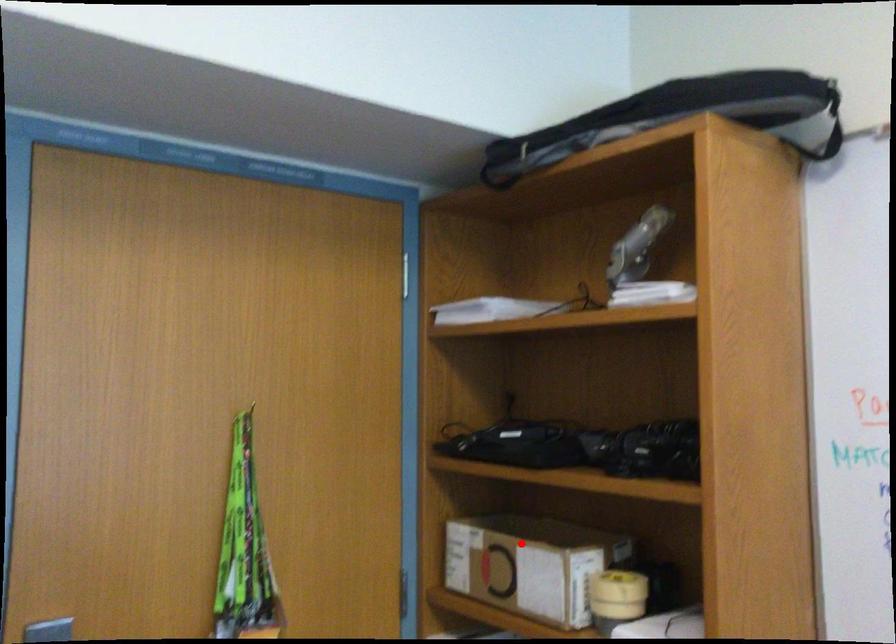
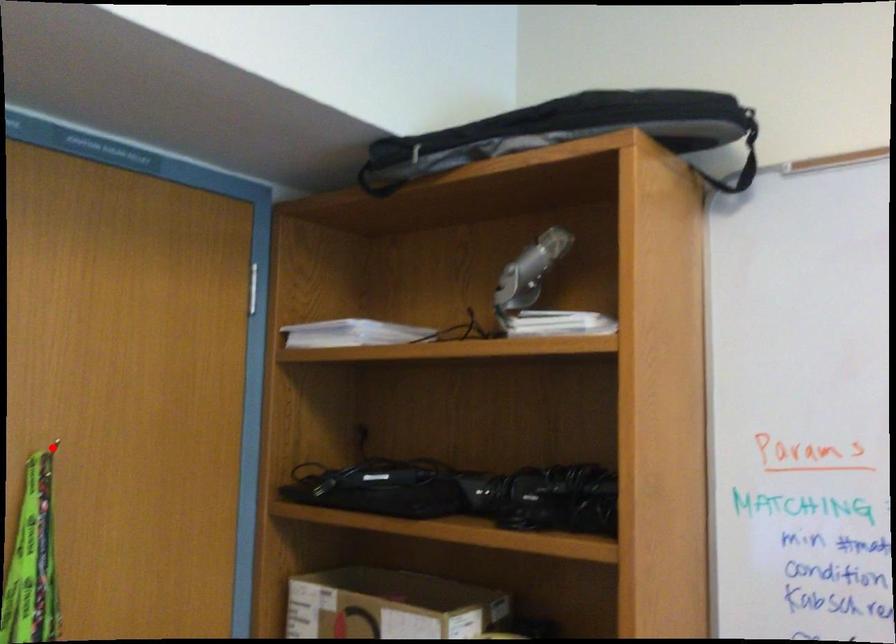
I am providing you with two images of the same scene from different viewpoints. A red point is marked on the first image and another point is marked on the second image. Does the point marked in image1 correspond to the same location as the one in image2?

No